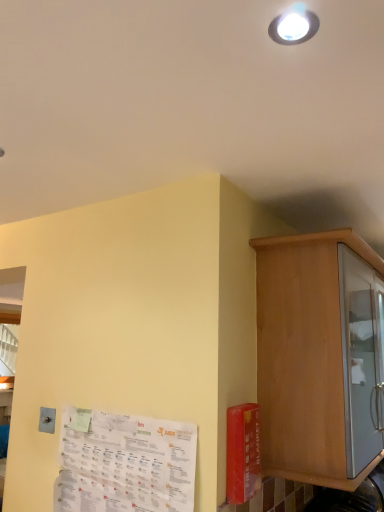
Where is `wooden cabinet at right`? The height and width of the screenshot is (512, 384). wooden cabinet at right is located at coordinates (314, 354).

The image size is (384, 512). Describe the element at coordinates (314, 354) in the screenshot. I see `wooden cabinet at right` at that location.

This screenshot has width=384, height=512. Describe the element at coordinates (124, 463) in the screenshot. I see `white paper at lower left` at that location.

Locate an element on the screen. This screenshot has width=384, height=512. white paper at lower left is located at coordinates (124, 463).

I want to click on wooden cabinet at right, so click(314, 354).

Can you confirm if wooden cabinet at right is positioned to the right of white paper at lower left?

Yes, wooden cabinet at right is to the right of white paper at lower left.

Which object is further away from the camera, wooden cabinet at right or white paper at lower left?

wooden cabinet at right is more distant.

Is point (271, 340) more distant than point (176, 457)?

Yes, it is.

From the image's perspective, between wooden cabinet at right and white paper at lower left, which one is located above?

wooden cabinet at right appears higher in the image.

From a real-world perspective, is wooden cabinet at right located beneath white paper at lower left?

Actually, wooden cabinet at right is physically above white paper at lower left in the real world.

Does wooden cabinet at right have a lesser width compared to white paper at lower left?

In fact, wooden cabinet at right might be wider than white paper at lower left.

Looking at this image, who is taller, wooden cabinet at right or white paper at lower left?

wooden cabinet at right is taller.

Looking at the image, does wooden cabinet at right seem bigger or smaller compared to white paper at lower left?

Considering their sizes, wooden cabinet at right takes up more space than white paper at lower left.

Is wooden cabinet at right outside of white paper at lower left?

wooden cabinet at right is positioned outside white paper at lower left.

Would you say wooden cabinet at right is a long distance from white paper at lower left?

wooden cabinet at right is actually quite close to white paper at lower left.

Is wooden cabinet at right facing away from white paper at lower left?

No, wooden cabinet at right is not facing the opposite direction of white paper at lower left.

How many degrees apart are the facing directions of wooden cabinet at right and white paper at lower left?

90.2 degrees.

I want to click on cabinetry lying behind the white paper at lower left, so click(x=314, y=354).

Is white paper at lower left to the left or to the right of wooden cabinet at right in the image?

From the image, it's evident that white paper at lower left is to the left of wooden cabinet at right.

Is white paper at lower left in front of wooden cabinet at right?

Yes, it is in front of wooden cabinet at right.

Considering the positions of point (94, 431) and point (269, 323), is point (94, 431) closer or farther from the camera than point (269, 323)?

Point (94, 431) is positioned closer to the camera compared to point (269, 323).

From the image's perspective, which is below, white paper at lower left or wooden cabinet at right?

white paper at lower left, from the image's perspective.

From a real-world perspective, which object stands above the other?

From a 3D spatial view, wooden cabinet at right is above.

Is white paper at lower left wider than wooden cabinet at right?

Incorrect, the width of white paper at lower left does not surpass that of wooden cabinet at right.

Can you confirm if white paper at lower left is shorter than wooden cabinet at right?

Correct, white paper at lower left is not as tall as wooden cabinet at right.

Can you confirm if white paper at lower left is smaller than wooden cabinet at right?

Yes, white paper at lower left is smaller than wooden cabinet at right.

Is white paper at lower left inside the boundaries of wooden cabinet at right, or outside?

white paper at lower left is spatially situated outside wooden cabinet at right.

Is white paper at lower left far from wooden cabinet at right?

No, there isn't a large distance between white paper at lower left and wooden cabinet at right.

Is white paper at lower left facing away from wooden cabinet at right?

Yes, wooden cabinet at right is at the back of white paper at lower left.

You are a GUI agent. You are given a task and a screenshot of the screen. Output one action in this format:
    pyautogui.click(x=<x>, y=<y>)
    Task: Click on the paper on the left of the wooden cabinet at right
    
    Given the screenshot: What is the action you would take?
    pyautogui.click(x=124, y=463)

Image resolution: width=384 pixels, height=512 pixels. Identify the location of cabinetry located behind the white paper at lower left. (314, 354).

This screenshot has width=384, height=512. Find the location of `paper to the left of wooden cabinet at right`. paper to the left of wooden cabinet at right is located at coordinates (124, 463).